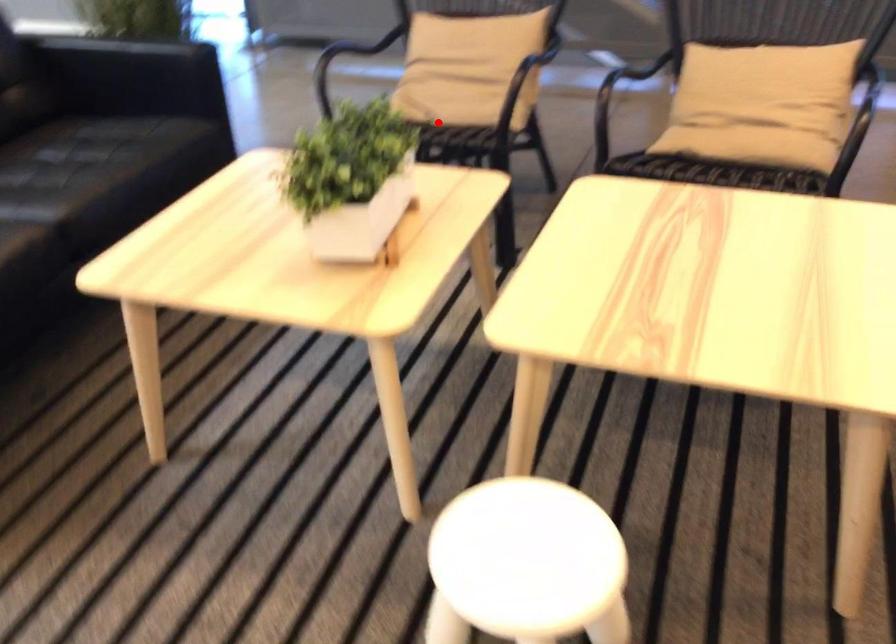
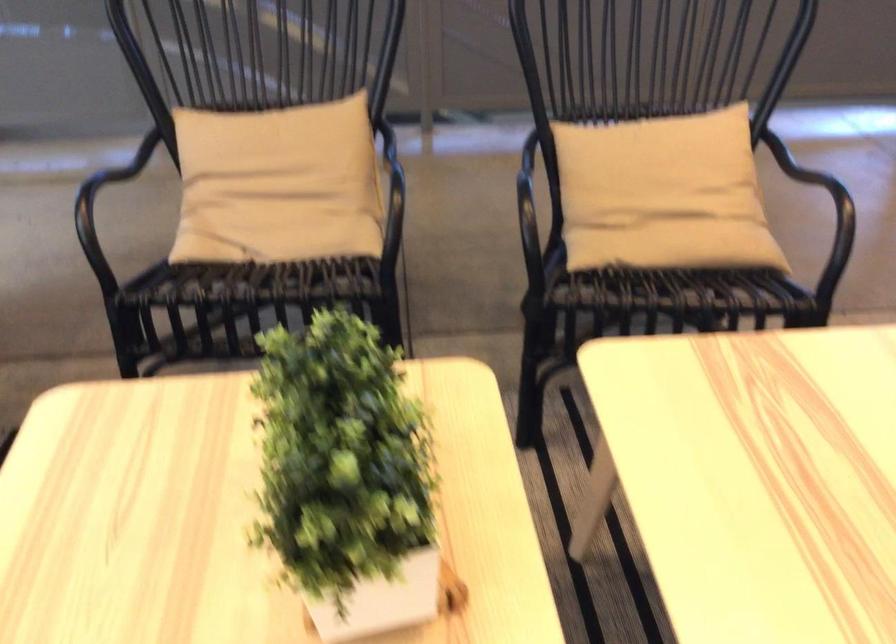
Question: A red point is marked in image1. In image2, is the corresponding 3D point closer to the camera or farther? Reply with the corresponding letter.

Choices:
 (A) The corresponding 3D point is closer.
 (B) The corresponding 3D point is farther.

Answer: (A)